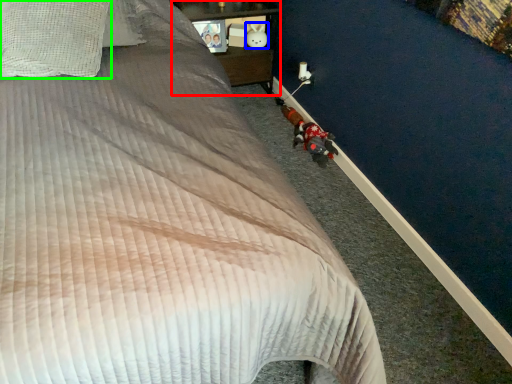
Question: Based on their relative distances, which object is nearer to furniture (highlighted by a red box)? Choose from toy (highlighted by a blue box) and pillow (highlighted by a green box).

Choices:
 (A) toy
 (B) pillow

Answer: (A)